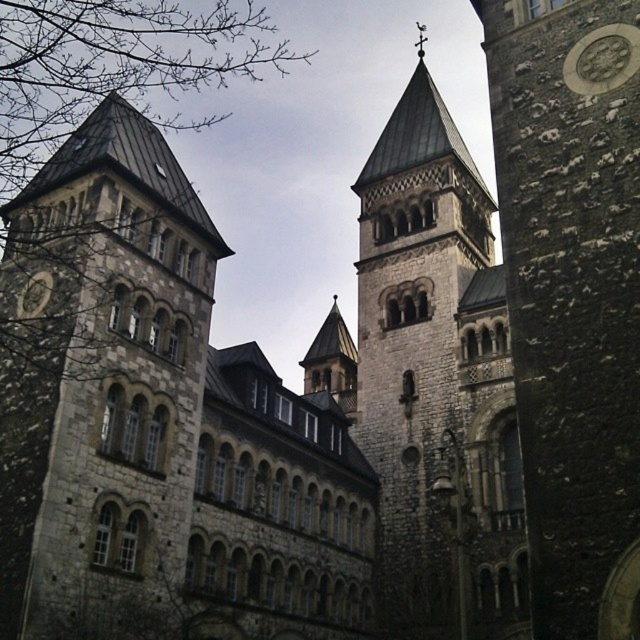
Question: Does stone tower at left have a greater width compared to rough stone clock tower at right?

Choices:
 (A) no
 (B) yes

Answer: (B)

Question: Does rough stone clock tower at right appear on the left side of silver metallic clock at upper right?

Choices:
 (A) yes
 (B) no

Answer: (A)

Question: Among these points, which one is nearest to the camera?

Choices:
 (A) (557, 392)
 (B) (563, 77)

Answer: (A)

Question: Among these objects, which one is farthest from the camera?

Choices:
 (A) rough stone clock tower at right
 (B) stone textured tower at center
 (C) stone tower at left

Answer: (B)

Question: Does rough stone clock tower at right have a larger size compared to silver metallic clock at upper right?

Choices:
 (A) yes
 (B) no

Answer: (A)

Question: Which of the following is the farthest from the observer?

Choices:
 (A) stone tower at left
 (B) silver metallic clock at upper right
 (C) stone textured tower at center
 (D) rough stone clock tower at right

Answer: (C)